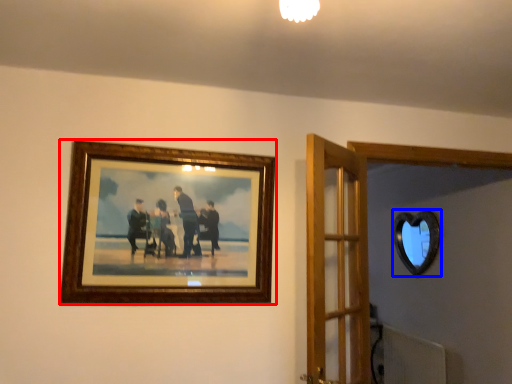
Question: Which point is closer to the camera, picture frame (highlighted by a red box) or mirror (highlighted by a blue box)?

Choices:
 (A) picture frame
 (B) mirror

Answer: (A)